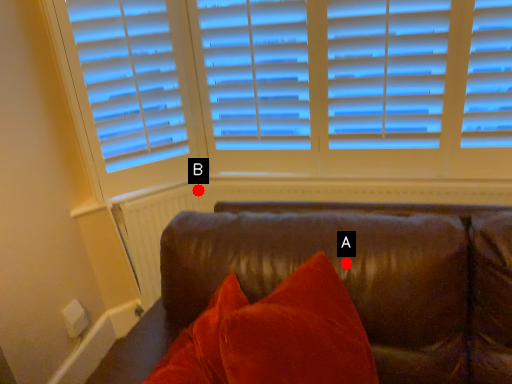
Question: Two points are circled on the image, labeled by A and B beside each circle. Which point appears closest to the camera in this image?

Choices:
 (A) A is closer
 (B) B is closer

Answer: (A)